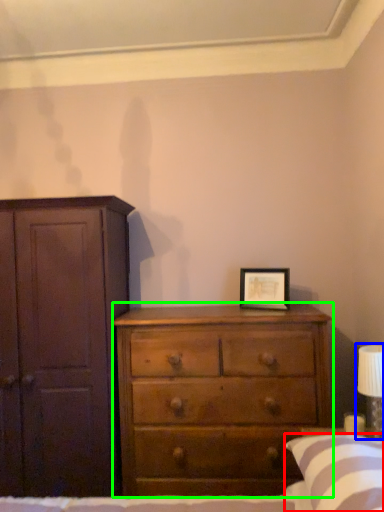
Question: Which is nearer to the pillow (highlighted by a red box)? bedside lamp (highlighted by a blue box) or chest of drawers (highlighted by a green box).

Choices:
 (A) bedside lamp
 (B) chest of drawers

Answer: (A)